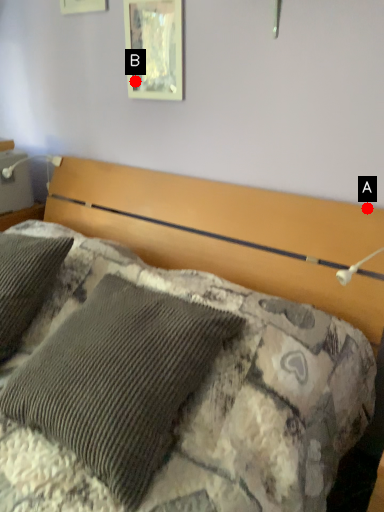
Question: Two points are circled on the image, labeled by A and B beside each circle. Which point is further to the camera?

Choices:
 (A) A is further
 (B) B is further

Answer: (B)